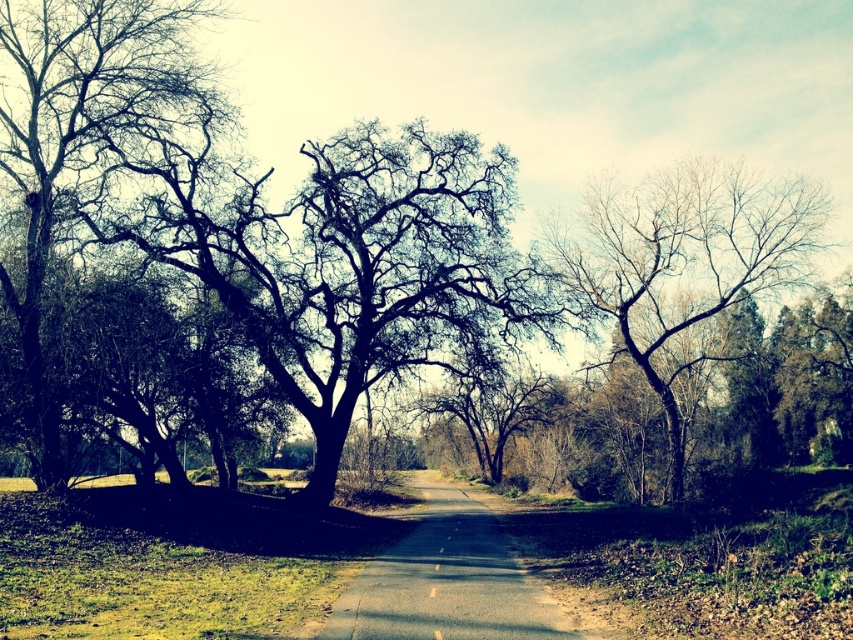
Question: Does dark brown bark tree at center have a smaller size compared to bare branches at right?

Choices:
 (A) no
 (B) yes

Answer: (A)

Question: Which is nearer to the bare branches at right?

Choices:
 (A) dark brown bark tree at center
 (B) dark green textured tree at left

Answer: (A)

Question: Considering the real-world distances, which object is closest to the dark brown bark tree at center?

Choices:
 (A) dark green textured tree at left
 (B) bare branches at right

Answer: (A)

Question: Is dark brown bark tree at center closer to the viewer compared to dark green textured tree at left?

Choices:
 (A) no
 (B) yes

Answer: (A)

Question: Is dark brown bark tree at center to the right of bare branches at right from the viewer's perspective?

Choices:
 (A) yes
 (B) no

Answer: (B)

Question: Which point is closer to the camera taking this photo?

Choices:
 (A) click(x=718, y=246)
 (B) click(x=296, y=333)

Answer: (B)